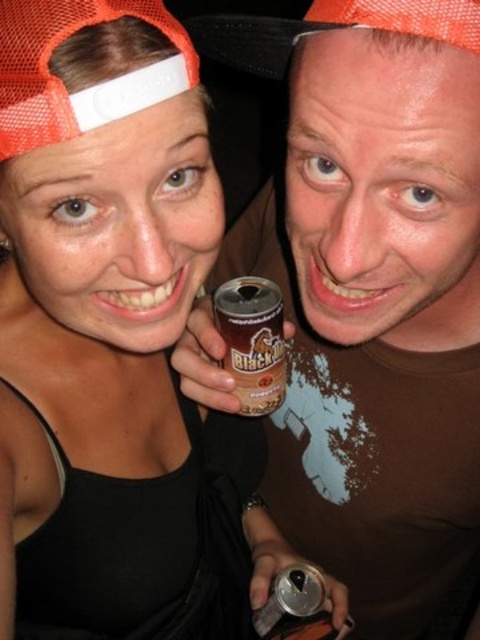
Question: Can you confirm if brown matte t-shirt at center is bigger than black matte can at center?

Choices:
 (A) yes
 (B) no

Answer: (A)

Question: Among these points, which one is farthest from the camera?

Choices:
 (A) (240, 316)
 (B) (444, 410)

Answer: (B)

Question: Which point appears farthest from the camera in this image?

Choices:
 (A) (362, 452)
 (B) (225, 339)

Answer: (A)

Question: Which point is closer to the camera taking this photo?

Choices:
 (A) (392, 280)
 (B) (260, 368)

Answer: (A)

Question: Is brown matte t-shirt at center further to the viewer compared to black matte can at center?

Choices:
 (A) no
 (B) yes

Answer: (A)

Question: Can you confirm if brown matte t-shirt at center is positioned above black matte can at center?

Choices:
 (A) yes
 (B) no

Answer: (B)